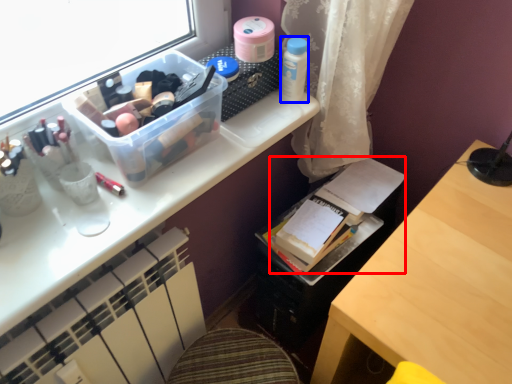
Question: Which object appears farthest to the camera in this image, book (highlighted by a red box) or toiletry (highlighted by a blue box)?

Choices:
 (A) book
 (B) toiletry

Answer: (A)